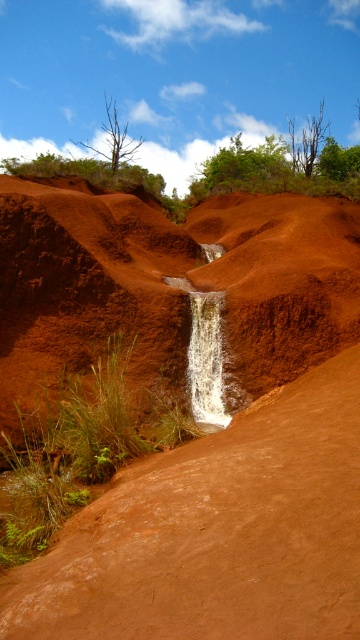
Question: In this image, where is smooth reddish-brown dirt at center located relative to white textured waterfall at center?

Choices:
 (A) left
 (B) right

Answer: (A)

Question: Does smooth reddish-brown dirt at center appear on the right side of bare wood tree at upper center?

Choices:
 (A) no
 (B) yes

Answer: (A)

Question: Which object appears closest to the camera in this image?

Choices:
 (A) green leafy tree at upper center
 (B) dead brown tree at upper center

Answer: (A)

Question: Does dead brown tree at upper center have a greater width compared to bare wood tree at upper center?

Choices:
 (A) no
 (B) yes

Answer: (B)

Question: Which point is closer to the camera?

Choices:
 (A) bare wood tree at upper center
 (B) white textured waterfall at center
 (C) green leafy tree at upper center
 (D) smooth reddish-brown dirt at center

Answer: (D)

Question: Among these objects, which one is nearest to the camera?

Choices:
 (A) green leafy tree at upper center
 (B) smooth reddish-brown dirt at center

Answer: (B)